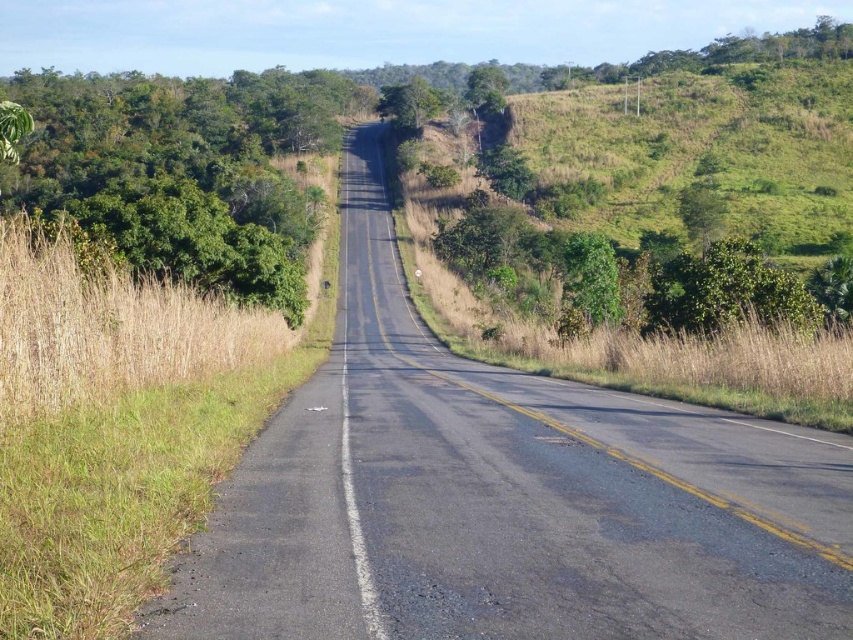
Question: Which object appears farthest from the camera in this image?

Choices:
 (A) green leafy tree at center
 (B) green leafy tree at left
 (C) black asphalt highway at center

Answer: (A)

Question: Is black asphalt highway at center positioned at the back of green leafy tree at center?

Choices:
 (A) no
 (B) yes

Answer: (A)

Question: Is black asphalt highway at center to the left of green leafy tree at left from the viewer's perspective?

Choices:
 (A) no
 (B) yes

Answer: (A)

Question: Which of these objects is positioned closest to the black asphalt highway at center?

Choices:
 (A) green leafy tree at center
 (B) green leafy tree at left

Answer: (B)

Question: Does black asphalt highway at center appear on the left side of green leafy tree at center?

Choices:
 (A) no
 (B) yes

Answer: (A)

Question: Which point is farther to the camera?

Choices:
 (A) green leafy tree at left
 (B) black asphalt highway at center
 (C) green leafy tree at center

Answer: (C)